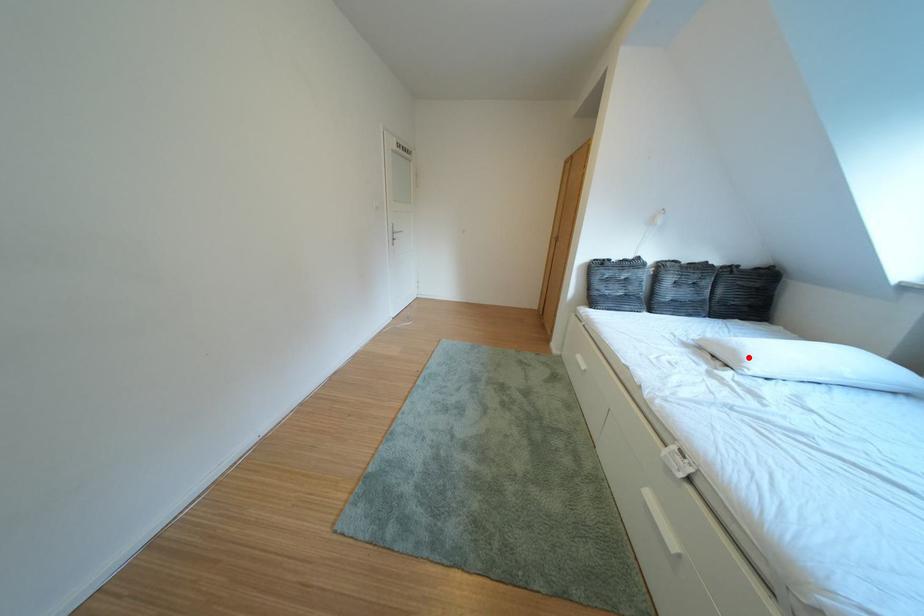
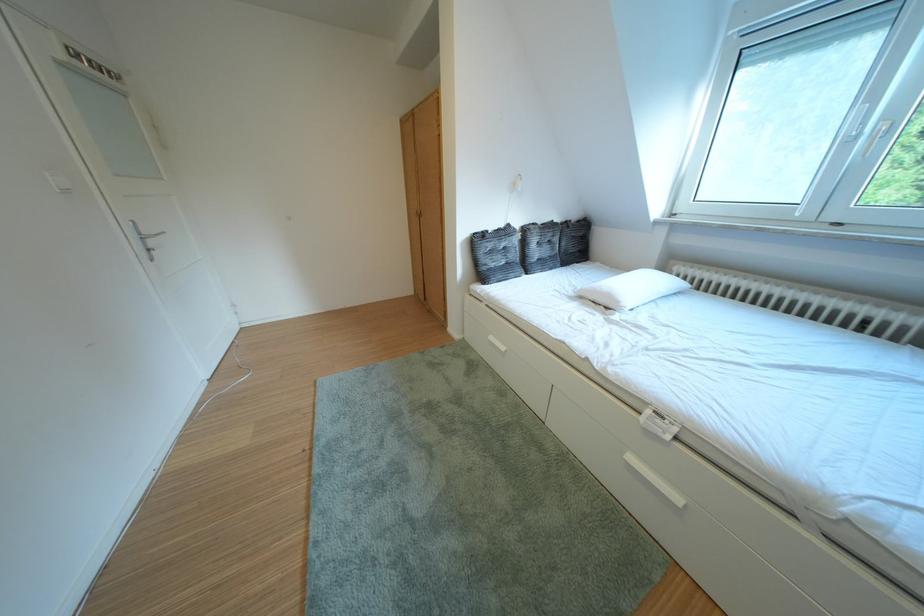
In the second image, find the point that corresponds to the highlighted location in the first image.

(623, 301)